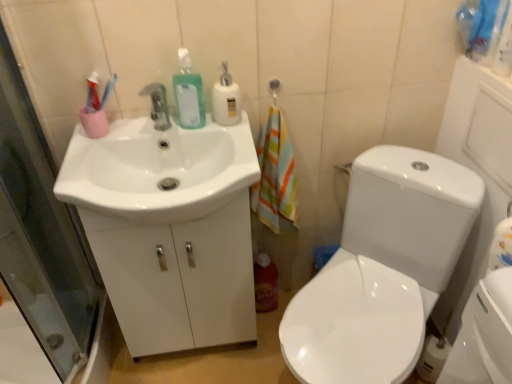
This screenshot has height=384, width=512. I want to click on free point to the left of matte silver faucet at center, so click(x=106, y=147).